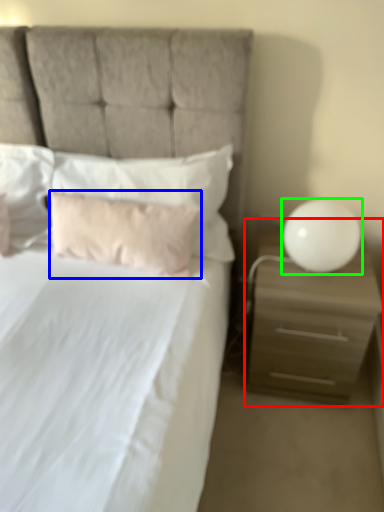
Question: Based on their relative distances, which object is nearer to nightstand (highlighted by a red box)? Choose from pillow (highlighted by a blue box) and table lamp (highlighted by a green box).

Choices:
 (A) pillow
 (B) table lamp

Answer: (B)